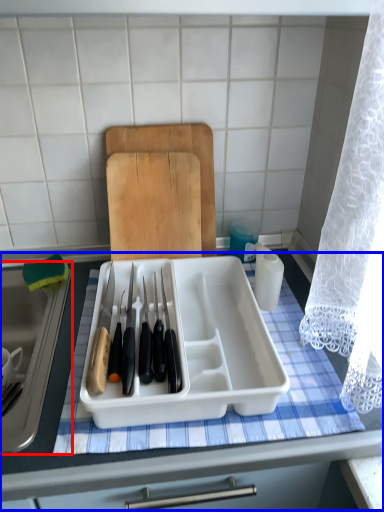
Question: Among these objects, which one is nearest to the camera, sink (highlighted by a red box) or table (highlighted by a blue box)?

Choices:
 (A) sink
 (B) table

Answer: (B)